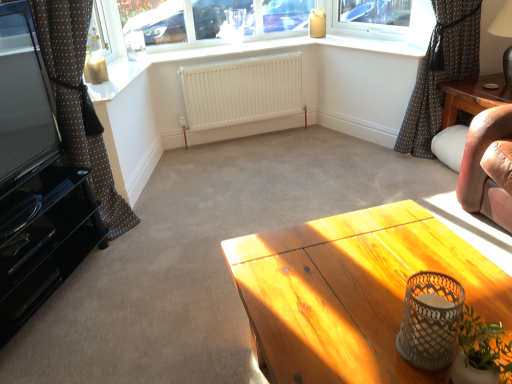
Question: Choose the correct answer: Is brown dotted fabric at right, the first curtain positioned from the right, inside white matte radiator at center or outside it?

Choices:
 (A) inside
 (B) outside

Answer: (B)

Question: Does point (437, 115) appear closer or farther from the camera than point (262, 69)?

Choices:
 (A) farther
 (B) closer

Answer: (B)

Question: Which object is positioned closest to the black glossy entertainment center at left?

Choices:
 (A) matte white window sill at upper center
 (B) white matte radiator at center
 (C) clear glass window at upper center
 (D) brown dotted fabric at right, the first curtain positioned from the right
 (E) white matte vase at lower right

Answer: (B)

Question: Which of these objects is positioned closest to the white matte radiator at center?

Choices:
 (A) brown dotted fabric at right, marked as the 2th curtain in a left-to-right arrangement
 (B) matte white window sill at upper center
 (C) white matte vase at lower right
 (D) black glossy entertainment center at left
 (E) brown polka dot fabric at left, the first curtain positioned from the left

Answer: (B)